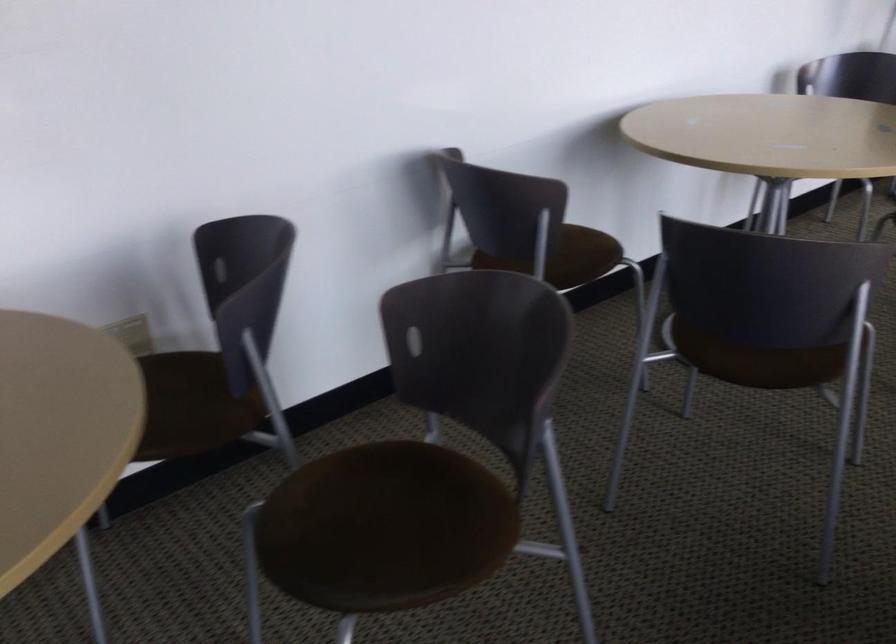
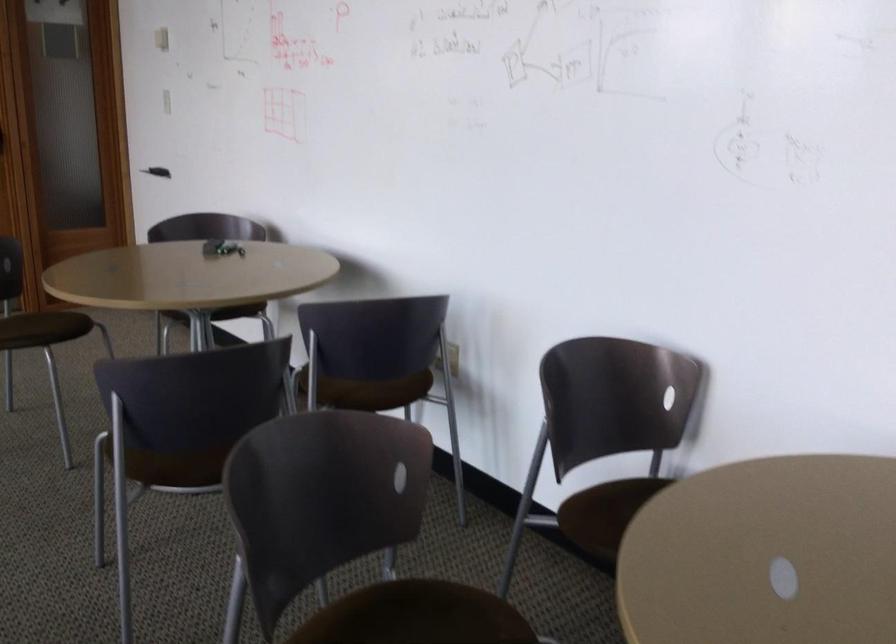
Locate, in the second image, the point that corresponds to point (724, 322) in the first image.

(418, 612)